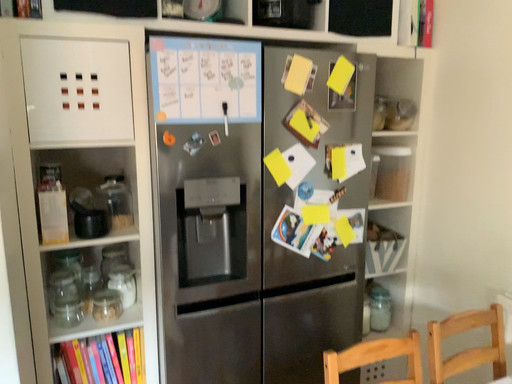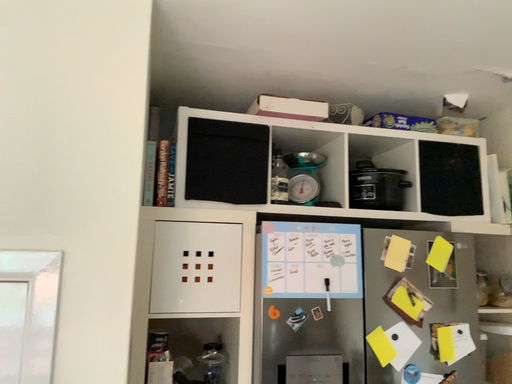
Question: How did the camera likely rotate when shooting the video?

Choices:
 (A) rotated left
 (B) rotated right

Answer: (A)